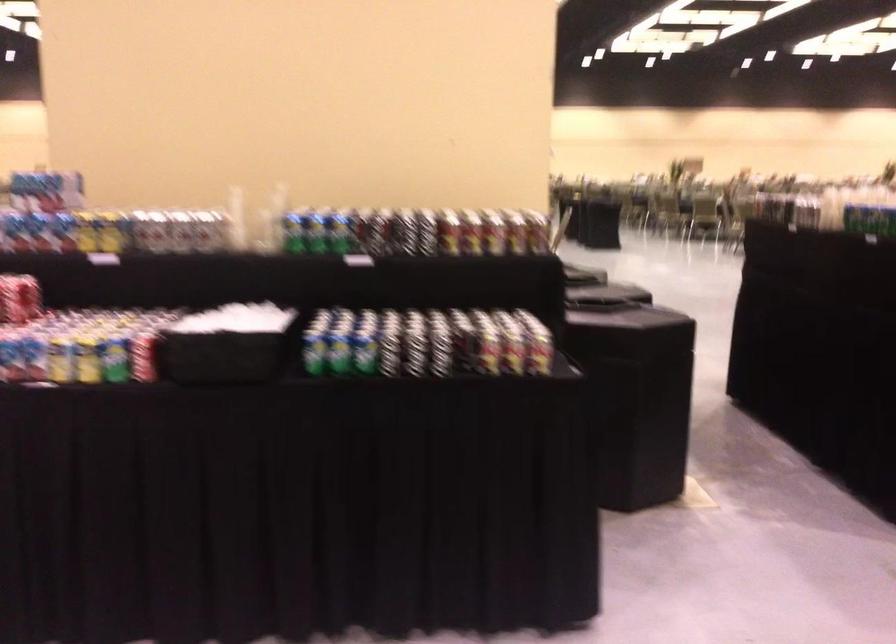
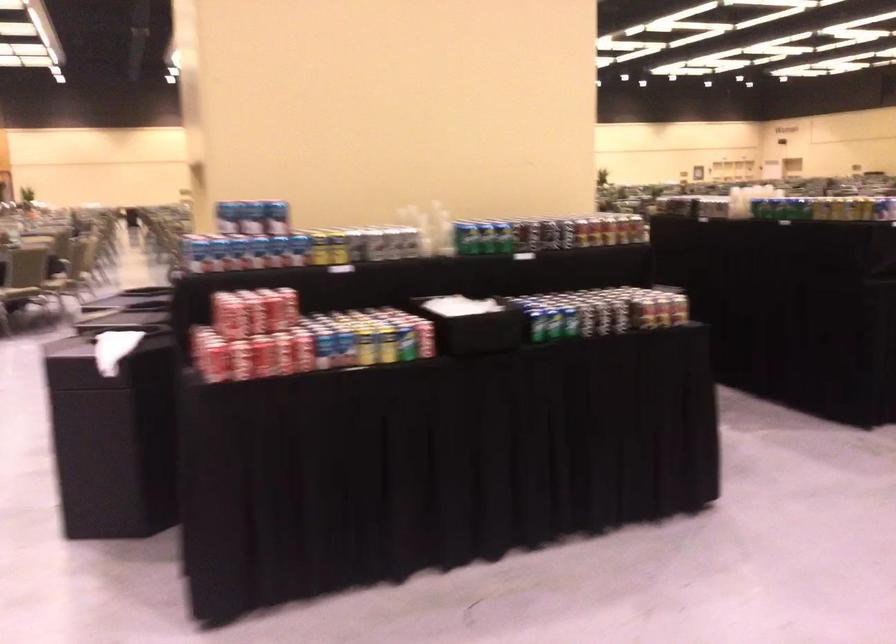
Where in the second image is the point corresponding to pixel 295 232 from the first image?

(466, 238)